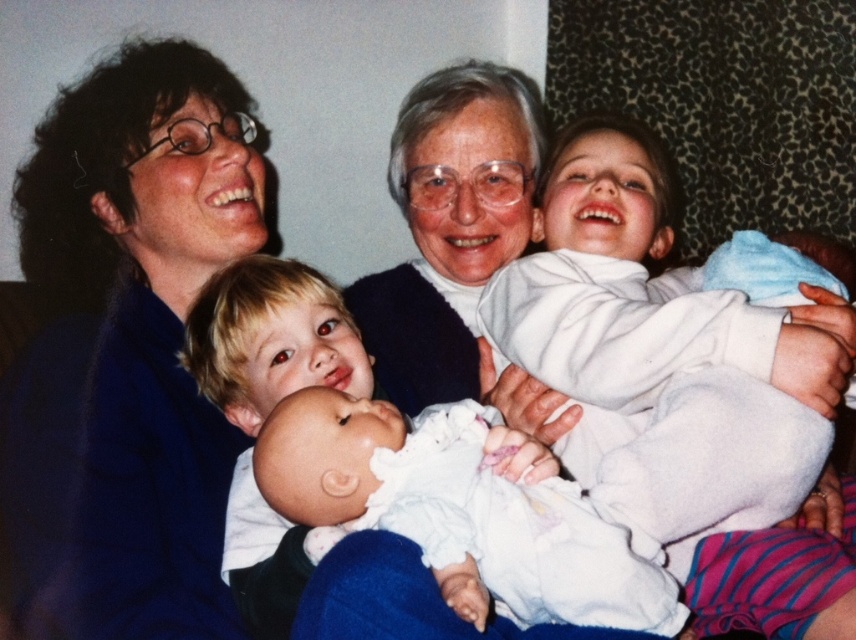
Question: Does matte blue sweater at upper left appear on the left side of white soft cloth at upper right?

Choices:
 (A) yes
 (B) no

Answer: (A)

Question: Which of the following is the closest to the observer?

Choices:
 (A) white soft fabric baby at center
 (B) matte blue sweater at upper left

Answer: (A)

Question: Which is farther from the matte blue sweater at upper left?

Choices:
 (A) white soft cloth at upper right
 (B) white soft fabric baby at center

Answer: (A)

Question: Which of the following is the farthest from the observer?

Choices:
 (A) (532, 490)
 (B) (123, 344)
 (C) (682, 362)

Answer: (B)

Question: Is the position of white soft cloth at upper right more distant than that of white soft fabric baby at center?

Choices:
 (A) no
 (B) yes

Answer: (B)

Question: Is white soft cloth at upper right bigger than white soft fabric baby at center?

Choices:
 (A) no
 (B) yes

Answer: (B)